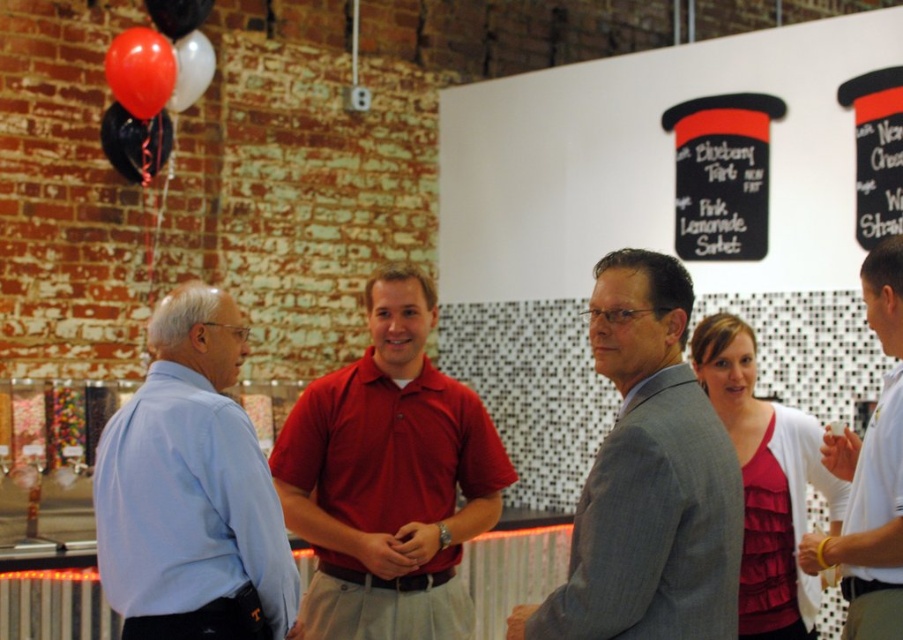
Question: Which object is positioned closest to the matte red polo shirt at center?

Choices:
 (A) black glossy balloon at upper left
 (B) shiny black balloon at upper left
 (C) matte black balloon at upper left

Answer: (C)

Question: Which point appears closest to the camera in this image?

Choices:
 (A) (170, 104)
 (B) (147, 45)

Answer: (B)

Question: Does shiny black balloon at upper left lie in front of black glossy balloon at upper left?

Choices:
 (A) no
 (B) yes

Answer: (A)

Question: Which object is positioned farthest from the black glossy balloon at upper left?

Choices:
 (A) ruffled red blouse at center
 (B) matte black balloon at upper left

Answer: (A)

Question: Is ruffled red blouse at center thinner than white cotton shirt at right?

Choices:
 (A) no
 (B) yes

Answer: (A)

Question: Is light blue shirt at left thinner than white cotton shirt at right?

Choices:
 (A) no
 (B) yes

Answer: (A)